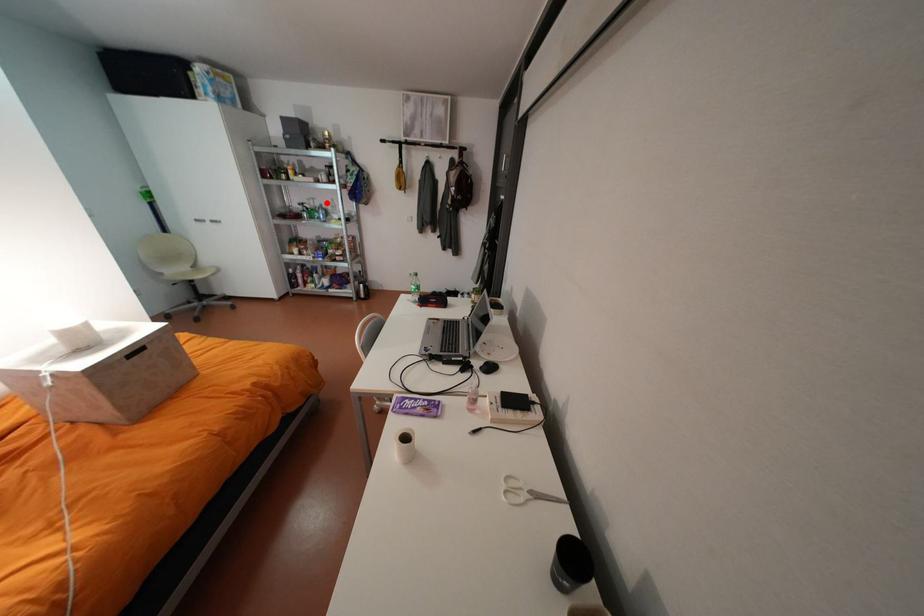
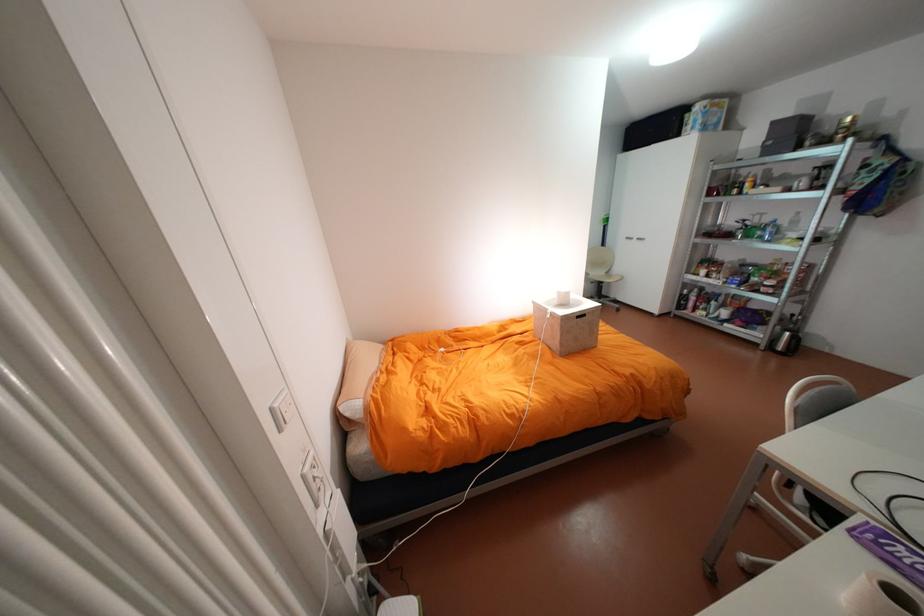
Question: A red point is marked in image1. In image2, is the corresponding 3D point closer to the camera or farther? Reply with the corresponding letter.

Choices:
 (A) The corresponding 3D point is closer.
 (B) The corresponding 3D point is farther.

Answer: (B)